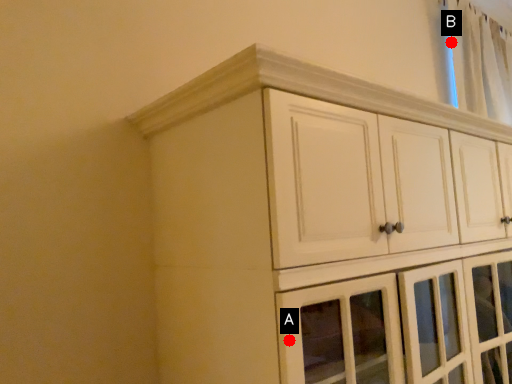
Question: Two points are circled on the image, labeled by A and B beside each circle. Which of the following is the closest to the observer?

Choices:
 (A) A is closer
 (B) B is closer

Answer: (A)